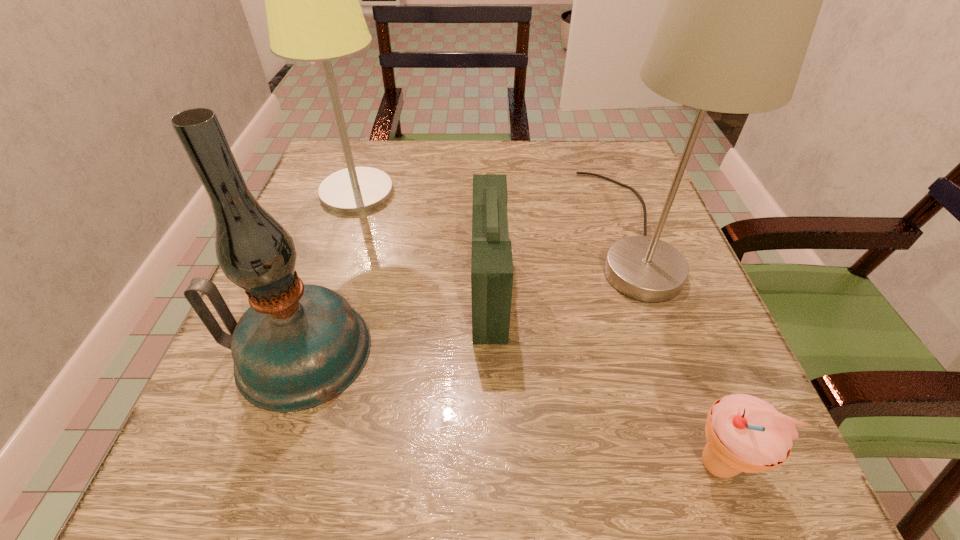
Identify which object is the fourth closest to the first-aid kit. Please provide its 2D coordinates. Your answer should be formatted as a tuple, i.e. [(x, y)], where the tuple contains the x and y coordinates of a point satisfying the conditions above.

[(744, 433)]

This screenshot has height=540, width=960. I want to click on vacant space that satisfies the following two spatial constraints: 1. on the front side of the right table lamp; 2. on the left side of the icecream, so click(711, 464).

Where is `free space that satisfies the following two spatial constraints: 1. on the back side of the third tallest object; 2. on the right side of the left table lamp`? The width and height of the screenshot is (960, 540). free space that satisfies the following two spatial constraints: 1. on the back side of the third tallest object; 2. on the right side of the left table lamp is located at coordinates (354, 192).